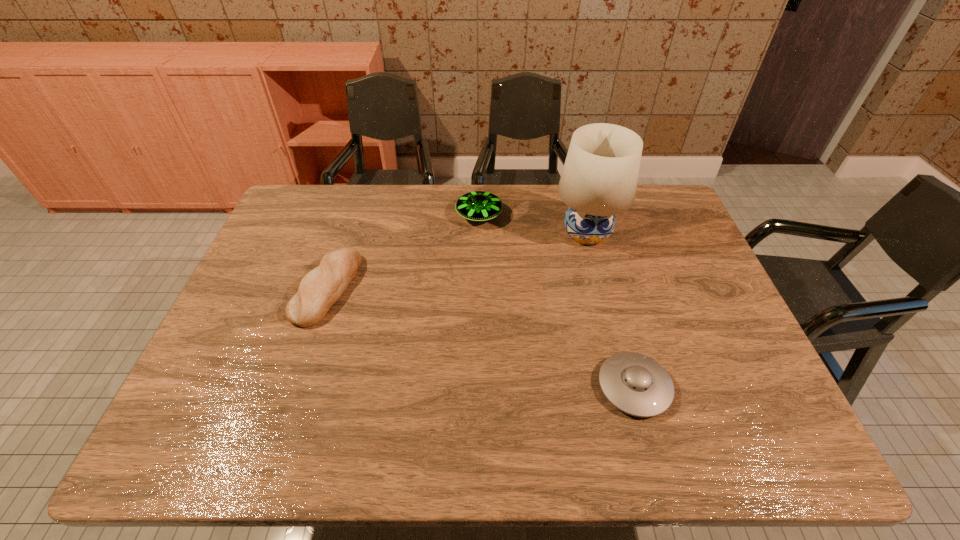
At what (x,y) coordinates should I click in order to perform the action: click on object that is the closest to the farther saucer. Please return your answer as a coordinate pair (x, y). The height and width of the screenshot is (540, 960). Looking at the image, I should click on (599, 179).

Find the location of a particular element. vacant region that satisfies the following two spatial constraints: 1. on the front-facing side of the nearer saucer; 2. on the right side of the lampshade is located at coordinates (626, 387).

Identify the location of free point that satisfies the following two spatial constraints: 1. on the front-facing side of the nearer saucer; 2. on the left side of the lampshade. (626, 387).

At what (x,y) coordinates should I click in order to perform the action: click on blank area in the image that satisfies the following two spatial constraints: 1. on the front-facing side of the lampshade; 2. on the left side of the nearer saucer. Please return your answer as a coordinate pair (x, y). The image size is (960, 540). Looking at the image, I should click on (626, 387).

At what (x,y) coordinates should I click in order to perform the action: click on blank area in the image that satisfies the following two spatial constraints: 1. on the front-facing side of the shortest object; 2. on the right side of the lampshade. Please return your answer as a coordinate pair (x, y). Looking at the image, I should click on pyautogui.click(x=626, y=387).

Where is `vacant space that satisfies the following two spatial constraints: 1. on the back side of the bread; 2. on the left side of the taller saucer`? This screenshot has height=540, width=960. vacant space that satisfies the following two spatial constraints: 1. on the back side of the bread; 2. on the left side of the taller saucer is located at coordinates (350, 215).